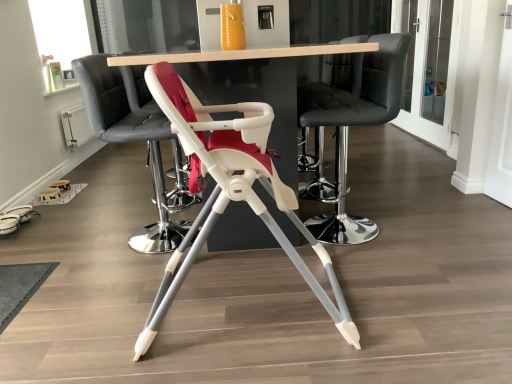
The height and width of the screenshot is (384, 512). I want to click on free spot to the left of white plastic highchair at center, which is the first chair in front-to-back order, so click(x=96, y=328).